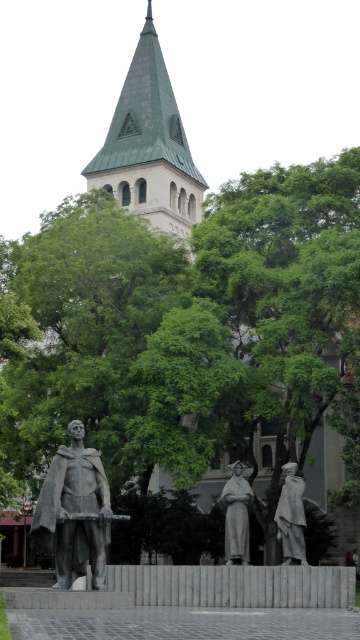
Does green leafy tree at center have a greater width compared to green metal tower at upper center?

Yes.

From the picture: Can you confirm if green leafy tree at center is positioned below green metal tower at upper center?

Yes, green leafy tree at center is below green metal tower at upper center.

Does point (95, 321) lie behind point (150, 1)?

No.

Where is `green leafy tree at center`? Image resolution: width=360 pixels, height=640 pixels. green leafy tree at center is located at coordinates (194, 326).

From the picture: Between green leafy tree at center and bronze statue at center, which one has more height?

green leafy tree at center is taller.

Who is positioned more to the right, green leafy tree at center or bronze statue at center?

From the viewer's perspective, green leafy tree at center appears more on the right side.

The image size is (360, 640). I want to click on green leafy tree at center, so point(194,326).

Is bronze statue at center positioned before bronze statue at right?

Yes.

Is bronze statue at center wider than bronze statue at right?

Yes.

Is point (79, 449) positioned after point (279, 504)?

No, it is not.

The height and width of the screenshot is (640, 360). In order to click on bronze statue at center in this screenshot , I will do `click(74, 512)`.